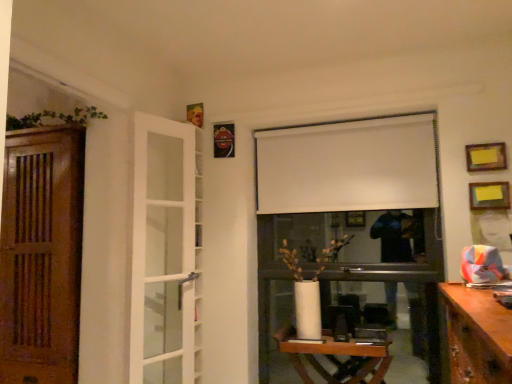
Locate an element on the screen. white matte curtain at upper center is located at coordinates (347, 166).

What do you see at coordinates (224, 140) in the screenshot? I see `metallic rectangular frame at upper center, which appears as the third picture frame when viewed from the right` at bounding box center [224, 140].

Describe the element at coordinates (337, 359) in the screenshot. The height and width of the screenshot is (384, 512). I see `wooden table at center` at that location.

In order to face white glass door at left, the 2th door from the left, should I rotate leftwards or rightwards?

Turn left approximately 11.728 degrees to face it.

You are a GUI agent. You are given a task and a screenshot of the screen. Output one action in this format:
    pyautogui.click(x=<x>, y=<y>)
    Task: Click on the white matte curtain at upper center
    The image size is (512, 384).
    Given the screenshot: What is the action you would take?
    pyautogui.click(x=347, y=166)

Based on their sizes in the image, would you say white matte curtain at upper center is bigger or smaller than wooden table at center?

Clearly, white matte curtain at upper center is smaller in size than wooden table at center.

Considering the positions of objects white matte curtain at upper center and wooden table at center in the image provided, who is more to the left, white matte curtain at upper center or wooden table at center?

wooden table at center.

Considering the sizes of objects white matte curtain at upper center and wooden table at center in the image provided, who is shorter, white matte curtain at upper center or wooden table at center?

Standing shorter between the two is wooden table at center.

Is white matte curtain at upper center inside the boundaries of metallic rectangular frame at upper center, which ranks as the 3th picture frame in bottom-to-top order, or outside?

white matte curtain at upper center is spatially situated outside metallic rectangular frame at upper center, which ranks as the 3th picture frame in bottom-to-top order.

Who is bigger, white matte curtain at upper center or metallic rectangular frame at upper center, the 1th picture frame when ordered from left to right?

With larger size is white matte curtain at upper center.

Is white matte curtain at upper center far from metallic rectangular frame at upper center, which ranks as the 3th picture frame in bottom-to-top order?

No.

Is white glass door at left, the 2th door from the left, behind wooden table at center?

Yes, white glass door at left, the 2th door from the left, is further from the viewer.

Considering the sizes of objects white glass door at left, the 2th door from the left, and wooden table at center in the image provided, who is bigger, white glass door at left, the 2th door from the left, or wooden table at center?

wooden table at center.

Considering the relative sizes of white glass door at left, the 2th door from the left, and wooden table at center in the image provided, is white glass door at left, the 2th door from the left, shorter than wooden table at center?

Incorrect, the height of white glass door at left, the 2th door from the left, does not fall short of that of wooden table at center.

Is white glass door at left, the first door when ordered from right to left, placed right next to wooden table at center?

They are not placed beside each other.

There is a white glass door at left, the first door when ordered from right to left. In order to click on curtain above it (from a real-world perspective) in this screenshot , I will do `click(347, 166)`.

Does point (166, 319) appear closer or farther from the camera than point (302, 182)?

Point (166, 319) is closer to the camera than point (302, 182).

Which of these two, white glass door at left, the first door when ordered from right to left, or white matte curtain at upper center, is bigger?

Bigger between the two is white glass door at left, the first door when ordered from right to left.

From a real-world perspective, is white glass door at left, the first door when ordered from right to left, positioned above or below white matte curtain at upper center?

From a real-world perspective, white glass door at left, the first door when ordered from right to left, is physically below white matte curtain at upper center.

Is point (489, 156) more distant than point (228, 133)?

No, it is not.

From the picture: Considering the positions of objects yellow paper at upper right, marked as the second picture frame in a left-to-right arrangement, and metallic rectangular frame at upper center, which appears as the third picture frame when viewed from the right, in the image provided, who is in front, yellow paper at upper right, marked as the second picture frame in a left-to-right arrangement, or metallic rectangular frame at upper center, which appears as the third picture frame when viewed from the right,?

yellow paper at upper right, marked as the second picture frame in a left-to-right arrangement, is closer to the camera.

What are the coordinates of `picture frame that is above the yellow paper at upper right, positioned as the second picture frame in top-to-bottom order (from the image's perspective)` in the screenshot? It's located at (224, 140).

From the image's perspective, is yellow paper at upper right, which is the 2th picture frame from front to back, above or below metallic rectangular frame at upper center, which ranks as the 3th picture frame in bottom-to-top order?

yellow paper at upper right, which is the 2th picture frame from front to back, is below metallic rectangular frame at upper center, which ranks as the 3th picture frame in bottom-to-top order.

Is metallic rectangular frame at upper center, which ranks as the 3th picture frame in bottom-to-top order, oriented away from white glass door at left, the first door when ordered from right to left?

No.

From a real-world perspective, which object stands above the other?

metallic rectangular frame at upper center, which appears as the third picture frame when viewed from the right, is physically above.

In the scene shown: Is metallic rectangular frame at upper center, which is counted as the first picture frame, starting from the back, to the left or to the right of white glass door at left, the 2th door from the left, in the image?

Based on their positions, metallic rectangular frame at upper center, which is counted as the first picture frame, starting from the back, is located to the right of white glass door at left, the 2th door from the left.

Starting from the metallic rectangular frame at upper center, marked as the 3th picture frame in a front-to-back arrangement, which door is the 1st one to the left? Please provide its 2D coordinates.

[(164, 250)]

Is yellow paper at upper right, which ranks as the 2th picture frame in back-to-front order, far away from yellow paper at upper right, marked as the first picture frame in a right-to-left arrangement?

No, yellow paper at upper right, which ranks as the 2th picture frame in back-to-front order, is not far from yellow paper at upper right, marked as the first picture frame in a right-to-left arrangement.

From a real-world perspective, which picture frame is the 1st one above the yellow paper at upper right, marked as the first picture frame in a bottom-to-top arrangement? Please provide its 2D coordinates.

[(486, 157)]

Based on the photo, between yellow paper at upper right, placed as the second picture frame when sorted from bottom to top, and yellow paper at upper right, marked as the third picture frame in a left-to-right arrangement, which one appears on the right side from the viewer's perspective?

yellow paper at upper right, marked as the third picture frame in a left-to-right arrangement, is more to the right.

Does yellow paper at upper right, positioned as the second picture frame in right-to-left order, lie in front of yellow paper at upper right, the 3th picture frame in the top-to-bottom sequence?

No, yellow paper at upper right, positioned as the second picture frame in right-to-left order, is further to the viewer.

This screenshot has height=384, width=512. Identify the location of table below the white matte curtain at upper center (from the image's perspective). (337, 359).

You are a GUI agent. You are given a task and a screenshot of the screen. Output one action in this format:
    pyautogui.click(x=<x>, y=<y>)
    Task: Click on the curtain lying on the right of metallic rectangular frame at upper center, which appears as the third picture frame when viewed from the right
    This screenshot has height=384, width=512.
    Given the screenshot: What is the action you would take?
    pyautogui.click(x=347, y=166)

Estimate the real-world distances between objects in this image. Which object is further from wooden table at center, white glass door at left, the 2th door from the left, or yellow paper at upper right, which is the 2th picture frame from front to back?

yellow paper at upper right, which is the 2th picture frame from front to back, is further to wooden table at center.

Looking at the image, which one is located closer to yellow paper at upper right, marked as the first picture frame in a bottom-to-top arrangement, yellow paper at upper right, placed as the second picture frame when sorted from bottom to top, or metallic rectangular frame at upper center, positioned as the 1th picture frame in top-to-bottom order?

yellow paper at upper right, placed as the second picture frame when sorted from bottom to top, is closer to yellow paper at upper right, marked as the first picture frame in a bottom-to-top arrangement.

Which object lies further to the anchor point white glass door at left, the 2th door from the left, yellow paper at upper right, which is the 2th picture frame from front to back, or wooden at left, placed as the 2th door when sorted from right to left?

yellow paper at upper right, which is the 2th picture frame from front to back, lies further to white glass door at left, the 2th door from the left, than the other object.

Estimate the real-world distances between objects in this image. Which object is further from wooden table at center, wooden at left, which is the first door from left to right, or yellow paper at upper right, marked as the second picture frame in a left-to-right arrangement?

wooden at left, which is the first door from left to right, is further to wooden table at center.

Estimate the real-world distances between objects in this image. Which object is further from metallic rectangular frame at upper center, the 1th picture frame when ordered from left to right, wooden table at center or yellow paper at upper right, marked as the first picture frame in a right-to-left arrangement?

yellow paper at upper right, marked as the first picture frame in a right-to-left arrangement, is further to metallic rectangular frame at upper center, the 1th picture frame when ordered from left to right.

Considering their positions, is white matte curtain at upper center positioned closer to metallic rectangular frame at upper center, the 1th picture frame when ordered from left to right, than white glass door at left, the 2th door from the left?

The object closer to metallic rectangular frame at upper center, the 1th picture frame when ordered from left to right, is white matte curtain at upper center.

Based on their spatial positions, is wooden table at center or wooden at left, which is the first door from left to right, closer to yellow paper at upper right, which ranks as the 2th picture frame in back-to-front order?

Among the two, wooden table at center is located nearer to yellow paper at upper right, which ranks as the 2th picture frame in back-to-front order.

From the image, which object appears to be farther from white matte curtain at upper center, yellow paper at upper right, marked as the second picture frame in a left-to-right arrangement, or white glass door at left, the 2th door from the left?

white glass door at left, the 2th door from the left, lies further to white matte curtain at upper center than the other object.

Image resolution: width=512 pixels, height=384 pixels. I want to click on picture frame located between metallic rectangular frame at upper center, the 1th picture frame when ordered from left to right, and yellow paper at upper right, marked as the first picture frame in a bottom-to-top arrangement, in the left-right direction, so click(486, 157).

Find the location of `table between wooden at left, which is the first door from left to right, and white matte curtain at upper center, in the horizontal direction`. table between wooden at left, which is the first door from left to right, and white matte curtain at upper center, in the horizontal direction is located at coordinates (337, 359).

Locate an element on the screen. The height and width of the screenshot is (384, 512). picture frame between wooden at left, which is the first door from left to right, and wooden table at center from left to right is located at coordinates (224, 140).

The image size is (512, 384). Find the location of `door between wooden at left, which is the first door from left to right, and yellow paper at upper right, positioned as the second picture frame in top-to-bottom order, from left to right`. door between wooden at left, which is the first door from left to right, and yellow paper at upper right, positioned as the second picture frame in top-to-bottom order, from left to right is located at coordinates (164, 250).